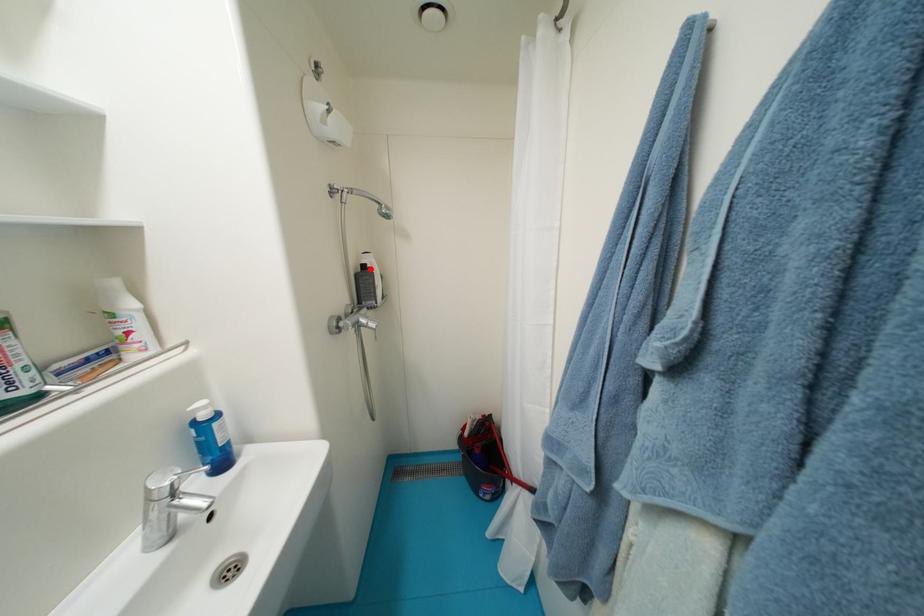
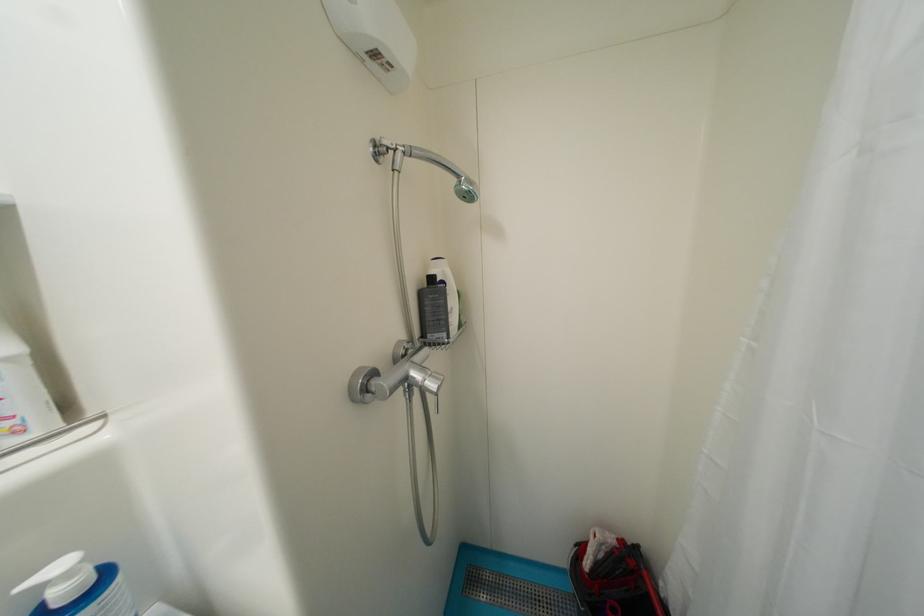
In the second image, find the point that corresponds to the highlighted location in the first image.

(439, 281)